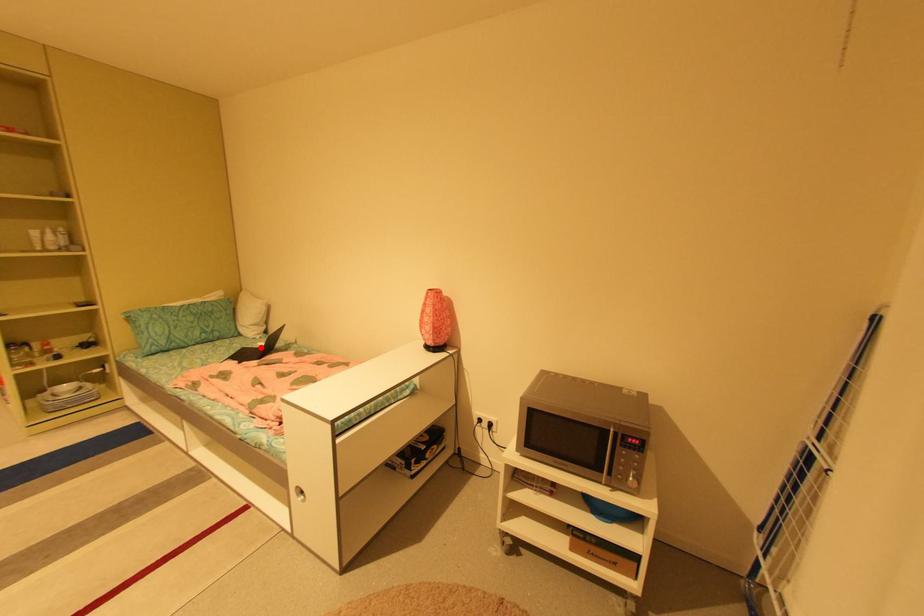
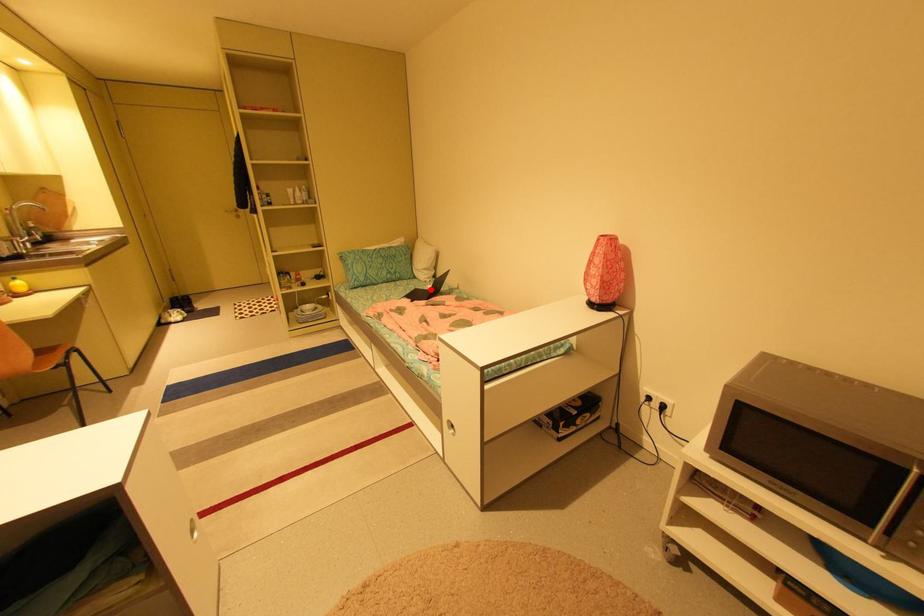
Based on the photo, I am providing you with two images of the same scene from different viewpoints. A red point is marked on the first image and another point is marked on the second image. Is the marked point in image1 the same physical position as the marked point in image2?

Yes